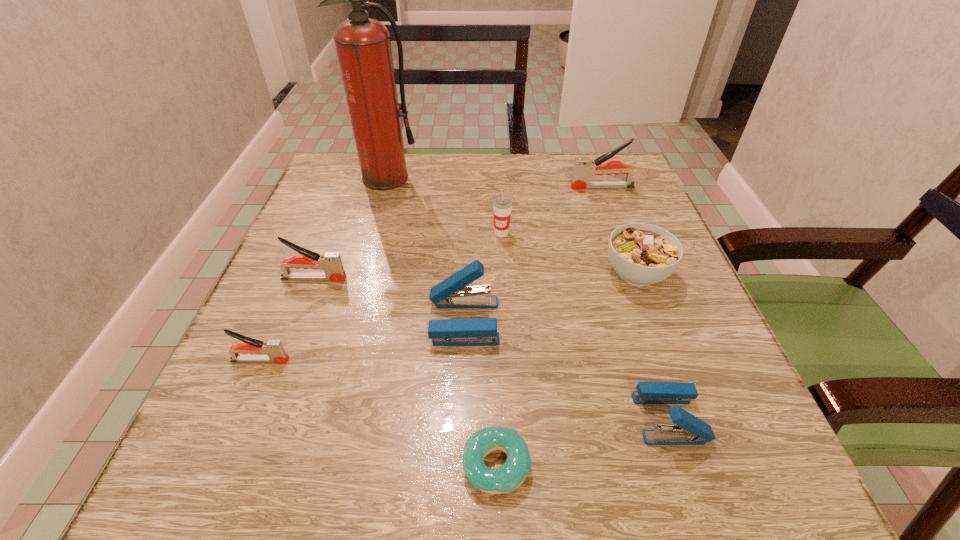
Where is `vacant space located on the side of the red cup with the logo`? The height and width of the screenshot is (540, 960). vacant space located on the side of the red cup with the logo is located at coordinates (506, 315).

This screenshot has height=540, width=960. Find the location of `free spot located 0.130m on the handle side of the second smallest gray stapler`. free spot located 0.130m on the handle side of the second smallest gray stapler is located at coordinates (415, 279).

The width and height of the screenshot is (960, 540). In order to click on blank space located 0.120m on the back of the left blue stapler in this screenshot , I will do `click(467, 254)`.

I want to click on free space located on the handle side of the nearest gray stapler, so click(x=408, y=360).

This screenshot has height=540, width=960. Find the location of `free space located 0.390m on the back of the white soup bowl`. free space located 0.390m on the back of the white soup bowl is located at coordinates (593, 156).

In order to click on vacant space positioned on the left of the right blue stapler in this screenshot , I will do (x=372, y=418).

Identify the location of vacant space positioned on the right of the doughnut. (583, 465).

Find the location of `fire extinguisher present at the far edge`. fire extinguisher present at the far edge is located at coordinates (363, 45).

Identify the location of stapler positioned at the far edge. (584, 168).

This screenshot has height=540, width=960. What are the coordinates of `stapler that is at the near edge` in the screenshot? It's located at pyautogui.click(x=689, y=430).